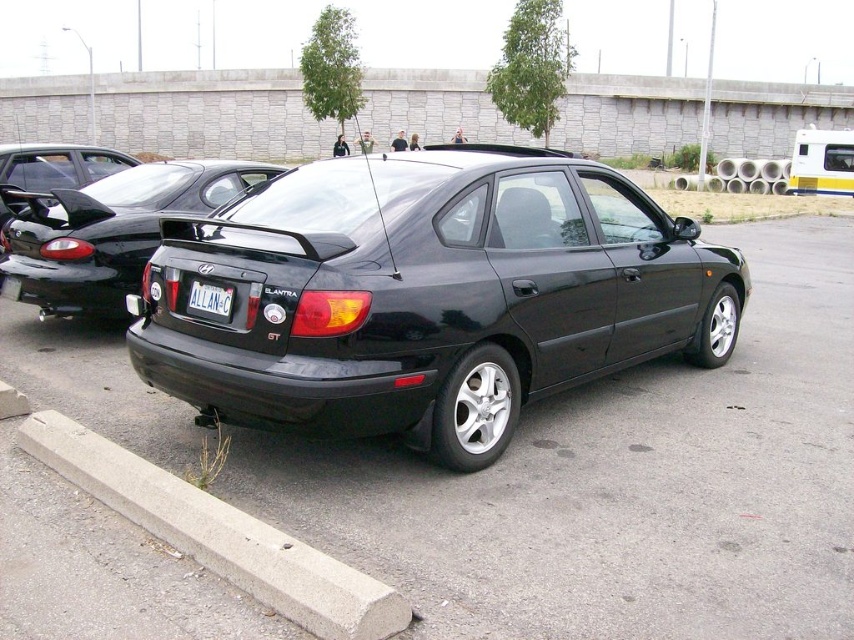
Question: Considering the relative positions of glossy black sedan at center and matte black hatchback at left in the image provided, where is glossy black sedan at center located with respect to matte black hatchback at left?

Choices:
 (A) left
 (B) right

Answer: (B)

Question: Which point appears closest to the camera in this image?

Choices:
 (A) (566, 355)
 (B) (189, 305)
 (C) (220, 557)
 (D) (53, 193)

Answer: (C)

Question: Which point is farther to the camera?

Choices:
 (A) glossy black car at center
 (B) concrete at lower left

Answer: (A)

Question: Which point is farther from the camera taking this photo?

Choices:
 (A) (184, 179)
 (B) (700, 611)
 (C) (209, 307)

Answer: (A)

Question: Does black matte car at center have a greater width compared to black plastic license plate at center?

Choices:
 (A) no
 (B) yes

Answer: (B)

Question: Does concrete at lower left have a greater width compared to matte black hatchback at left?

Choices:
 (A) yes
 (B) no

Answer: (B)